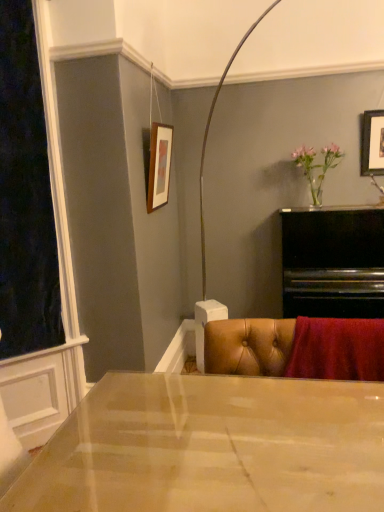
What are the coordinates of `pink glass vase at upper right` in the screenshot? It's located at (317, 167).

This screenshot has width=384, height=512. I want to click on matte wooden picture frame at upper center, the first picture frame from the left, so click(159, 165).

What do you see at coordinates (372, 143) in the screenshot?
I see `wooden picture frame at upper right, positioned as the 1th picture frame in right-to-left order` at bounding box center [372, 143].

I want to click on velvet dark at left, so click(25, 195).

You are a GUI agent. You are given a task and a screenshot of the screen. Output one action in this format:
    pyautogui.click(x=<x>, y=<y>)
    Task: Click on the pink glass vase at upper right
    This screenshot has height=512, width=384.
    Given the screenshot: What is the action you would take?
    click(x=317, y=167)

Can you confirm if wooden picture frame at upper right, which ranks as the second picture frame in left-to-right order, is wider than pink glass vase at upper right?

Incorrect, the width of wooden picture frame at upper right, which ranks as the second picture frame in left-to-right order, does not surpass that of pink glass vase at upper right.

You are a GUI agent. You are given a task and a screenshot of the screen. Output one action in this format:
    pyautogui.click(x=<x>, y=<y>)
    Task: Click on the floral arrangement lying on the left of wooden picture frame at upper right, positioned as the 1th picture frame in right-to-left order
    The image size is (384, 512).
    Given the screenshot: What is the action you would take?
    pyautogui.click(x=317, y=167)

From the image's perspective, does wooden picture frame at upper right, which ranks as the second picture frame in left-to-right order, appear higher than pink glass vase at upper right?

Indeed, from the image's perspective, wooden picture frame at upper right, which ranks as the second picture frame in left-to-right order, is shown above pink glass vase at upper right.

Can wooden picture frame at upper right, positioned as the 1th picture frame in right-to-left order, be found inside velvet dark at left?

Definitely not — wooden picture frame at upper right, positioned as the 1th picture frame in right-to-left order, is not inside velvet dark at left.

Is velvet dark at left positioned with its back to wooden picture frame at upper right, which ranks as the second picture frame in left-to-right order?

No, velvet dark at left's orientation is not away from wooden picture frame at upper right, which ranks as the second picture frame in left-to-right order.

From the picture: Is velvet dark at left taller or shorter than wooden picture frame at upper right, which ranks as the second picture frame in left-to-right order?

In the image, velvet dark at left appears to be taller than wooden picture frame at upper right, which ranks as the second picture frame in left-to-right order.

Could you measure the distance between velvet dark at left and wooden picture frame at upper right, positioned as the 1th picture frame in right-to-left order?

A distance of 7.46 feet exists between velvet dark at left and wooden picture frame at upper right, positioned as the 1th picture frame in right-to-left order.

Does velvet dark at left turn towards matte wooden picture frame at upper center, the second picture frame in the right-to-left sequence?

No, velvet dark at left is not turned towards matte wooden picture frame at upper center, the second picture frame in the right-to-left sequence.

Considering their positions, is velvet dark at left located in front of or behind matte wooden picture frame at upper center, the first picture frame from the left?

velvet dark at left is in front of matte wooden picture frame at upper center, the first picture frame from the left.

From a real-world perspective, between velvet dark at left and matte wooden picture frame at upper center, the second picture frame in the right-to-left sequence, who is vertically lower?

velvet dark at left is physically lower.

Is pink glass vase at upper right at the back of velvet dark at left?

No, velvet dark at left's orientation is not away from pink glass vase at upper right.

Is pink glass vase at upper right surrounded by velvet dark at left?

No, velvet dark at left does not contain pink glass vase at upper right.

How distant is velvet dark at left from pink glass vase at upper right?

velvet dark at left is 6.16 feet from pink glass vase at upper right.

In the scene shown: In terms of size, does velvet dark at left appear bigger or smaller than pink glass vase at upper right?

Considering their sizes, velvet dark at left takes up more space than pink glass vase at upper right.

Which of these two, pink glass vase at upper right or velvet dark at left, is smaller?

Smaller between the two is pink glass vase at upper right.

Is point (316, 182) farther from viewer compared to point (11, 334)?

That is True.

Is pink glass vase at upper right touching velvet dark at left?

There is a gap between pink glass vase at upper right and velvet dark at left.

Could you tell me if matte wooden picture frame at upper center, the second picture frame in the right-to-left sequence, is facing velvet dark at left?

No, matte wooden picture frame at upper center, the second picture frame in the right-to-left sequence, is not turned towards velvet dark at left.

Is point (165, 141) more distant than point (24, 64)?

Yes, it is.

In terms of width, does matte wooden picture frame at upper center, the first picture frame from the left, look wider or thinner when compared to velvet dark at left?

Clearly, matte wooden picture frame at upper center, the first picture frame from the left, has less width compared to velvet dark at left.

Is matte wooden picture frame at upper center, the second picture frame in the right-to-left sequence, taller or shorter than velvet dark at left?

In the image, matte wooden picture frame at upper center, the second picture frame in the right-to-left sequence, appears to be shorter than velvet dark at left.

From the picture: From a real-world perspective, who is located lower, matte wooden picture frame at upper center, the first picture frame from the left, or wooden picture frame at upper right, which ranks as the second picture frame in left-to-right order?

matte wooden picture frame at upper center, the first picture frame from the left, is physically lower.

Is matte wooden picture frame at upper center, the second picture frame in the right-to-left sequence, outside of wooden picture frame at upper right, which ranks as the second picture frame in left-to-right order?

Yes.

Measure the distance between matte wooden picture frame at upper center, the first picture frame from the left, and wooden picture frame at upper right, which ranks as the second picture frame in left-to-right order.

matte wooden picture frame at upper center, the first picture frame from the left, is 4.78 feet away from wooden picture frame at upper right, which ranks as the second picture frame in left-to-right order.

From the image's perspective, which picture frame is the 2nd one above the pink glass vase at upper right? Please provide its 2D coordinates.

[(372, 143)]

Identify the location of the 2nd picture frame to the right when counting from the velvet dark at left. Image resolution: width=384 pixels, height=512 pixels. (372, 143).

Based on their spatial positions, is velvet dark at left or pink glass vase at upper right closer to matte wooden picture frame at upper center, the second picture frame in the right-to-left sequence?

The object closer to matte wooden picture frame at upper center, the second picture frame in the right-to-left sequence, is velvet dark at left.

Considering their positions, is velvet dark at left positioned closer to matte wooden picture frame at upper center, the first picture frame from the left, than wooden picture frame at upper right, which ranks as the second picture frame in left-to-right order?

velvet dark at left.

Estimate the real-world distances between objects in this image. Which object is further from wooden picture frame at upper right, positioned as the 1th picture frame in right-to-left order, matte wooden picture frame at upper center, the second picture frame in the right-to-left sequence, or velvet dark at left?

velvet dark at left is positioned further to the anchor wooden picture frame at upper right, positioned as the 1th picture frame in right-to-left order.

Estimate the real-world distances between objects in this image. Which object is closer to pink glass vase at upper right, wooden picture frame at upper right, positioned as the 1th picture frame in right-to-left order, or velvet dark at left?

Based on the image, wooden picture frame at upper right, positioned as the 1th picture frame in right-to-left order, appears to be nearer to pink glass vase at upper right.

Estimate the real-world distances between objects in this image. Which object is further from matte wooden picture frame at upper center, the first picture frame from the left, wooden picture frame at upper right, which ranks as the second picture frame in left-to-right order, or velvet dark at left?

wooden picture frame at upper right, which ranks as the second picture frame in left-to-right order.

When comparing their distances from wooden picture frame at upper right, which ranks as the second picture frame in left-to-right order, does pink glass vase at upper right or matte wooden picture frame at upper center, the second picture frame in the right-to-left sequence, seem further?

matte wooden picture frame at upper center, the second picture frame in the right-to-left sequence.

Estimate the real-world distances between objects in this image. Which object is closer to pink glass vase at upper right, velvet dark at left or wooden picture frame at upper right, positioned as the 1th picture frame in right-to-left order?

wooden picture frame at upper right, positioned as the 1th picture frame in right-to-left order, is positioned closer to the anchor pink glass vase at upper right.

Estimate the real-world distances between objects in this image. Which object is further from wooden picture frame at upper right, positioned as the 1th picture frame in right-to-left order, velvet dark at left or matte wooden picture frame at upper center, the second picture frame in the right-to-left sequence?

velvet dark at left lies further to wooden picture frame at upper right, positioned as the 1th picture frame in right-to-left order, than the other object.

Identify the location of floral arrangement between velvet dark at left and wooden picture frame at upper right, which ranks as the second picture frame in left-to-right order, from left to right. This screenshot has width=384, height=512. (317, 167).

The height and width of the screenshot is (512, 384). Find the location of `floral arrangement between matte wooden picture frame at upper center, the first picture frame from the left, and wooden picture frame at upper right, which ranks as the second picture frame in left-to-right order, in the horizontal direction`. floral arrangement between matte wooden picture frame at upper center, the first picture frame from the left, and wooden picture frame at upper right, which ranks as the second picture frame in left-to-right order, in the horizontal direction is located at coordinates (317, 167).

Where is `picture frame between velvet dark at left and wooden picture frame at upper right, which ranks as the second picture frame in left-to-right order, from left to right`? Image resolution: width=384 pixels, height=512 pixels. picture frame between velvet dark at left and wooden picture frame at upper right, which ranks as the second picture frame in left-to-right order, from left to right is located at coordinates (159, 165).

Image resolution: width=384 pixels, height=512 pixels. Identify the location of picture frame between velvet dark at left and pink glass vase at upper right. (159, 165).